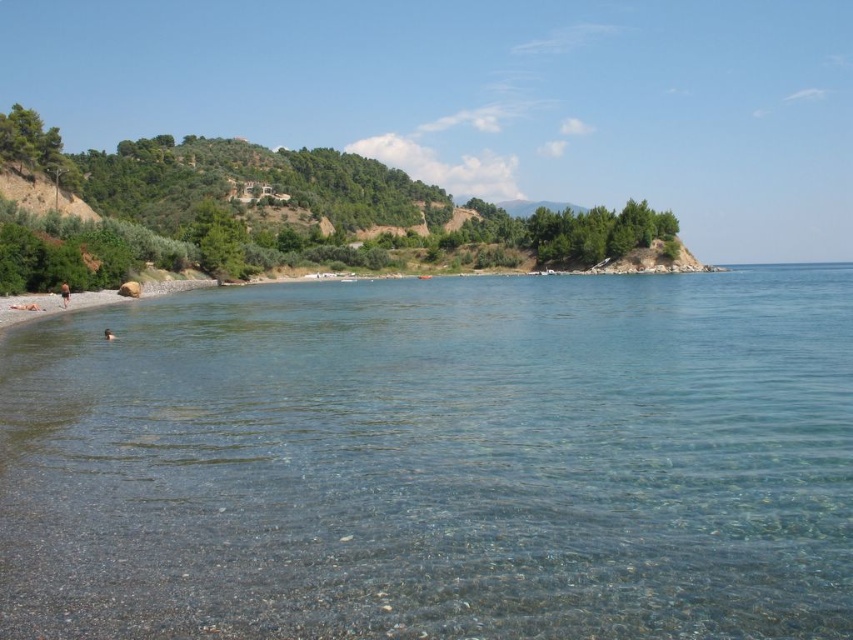
Question: Considering the relative positions of clear water at lower left and brown skin at lower left in the image provided, where is clear water at lower left located with respect to brown skin at lower left?

Choices:
 (A) right
 (B) left

Answer: (A)

Question: Which point appears closest to the camera in this image?

Choices:
 (A) (419, 317)
 (B) (65, 301)

Answer: (A)

Question: Can you confirm if clear water at lower left is positioned to the left of brown skin at lower left?

Choices:
 (A) no
 (B) yes

Answer: (A)

Question: Observing the image, what is the correct spatial positioning of clear water at lower left in reference to brown skin at lower left?

Choices:
 (A) left
 (B) right

Answer: (B)